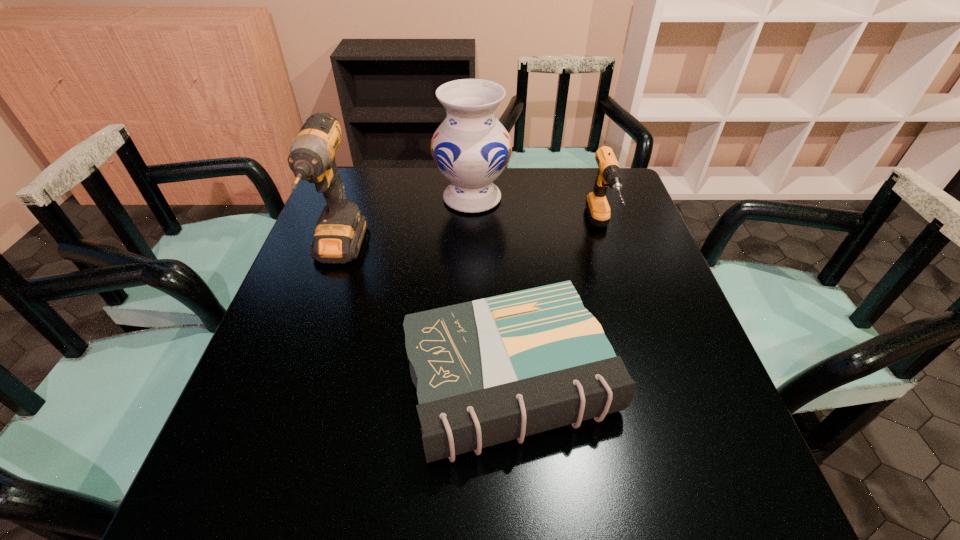
At what (x,y) coordinates should I click in order to perform the action: click on free space located on the left of the paperback book. Please return your answer as a coordinate pair (x, y). The width and height of the screenshot is (960, 540). Looking at the image, I should click on (310, 379).

The image size is (960, 540). I want to click on vase situated at the far edge, so click(471, 148).

The height and width of the screenshot is (540, 960). I want to click on drill present at the far edge, so pos(609,174).

Where is `object that is at the near edge`? Image resolution: width=960 pixels, height=540 pixels. object that is at the near edge is located at coordinates (488, 371).

Find the location of a particular element. The image size is (960, 540). object situated at the left edge is located at coordinates (340, 230).

Locate an element on the screen. object present at the right edge is located at coordinates (609, 174).

This screenshot has width=960, height=540. In order to click on object at the far right corner in this screenshot , I will do (609, 174).

The height and width of the screenshot is (540, 960). Find the location of `vacant space at the far edge of the desktop`. vacant space at the far edge of the desktop is located at coordinates (423, 167).

Identify the location of vacant region at the near edge of the desktop. (305, 471).

The image size is (960, 540). In the image, there is a desktop. Identify the location of free space at the left edge. (297, 401).